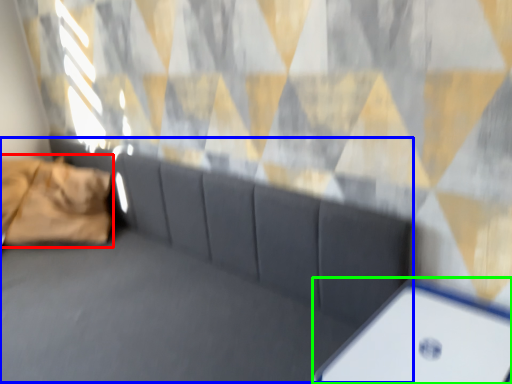
Question: Which object is positioned closest to pillow (highlighted by a red box)? Select from couch (highlighted by a blue box) and furniture (highlighted by a green box).

Choices:
 (A) couch
 (B) furniture

Answer: (A)